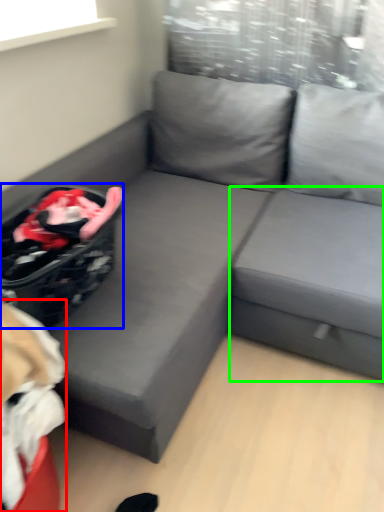
Question: Estimate the real-world distances between objects in this image. Which object is farther from bean bag chair (highlighted by a red box), laundry basket (highlighted by a blue box) or table (highlighted by a green box)?

Choices:
 (A) laundry basket
 (B) table

Answer: (B)